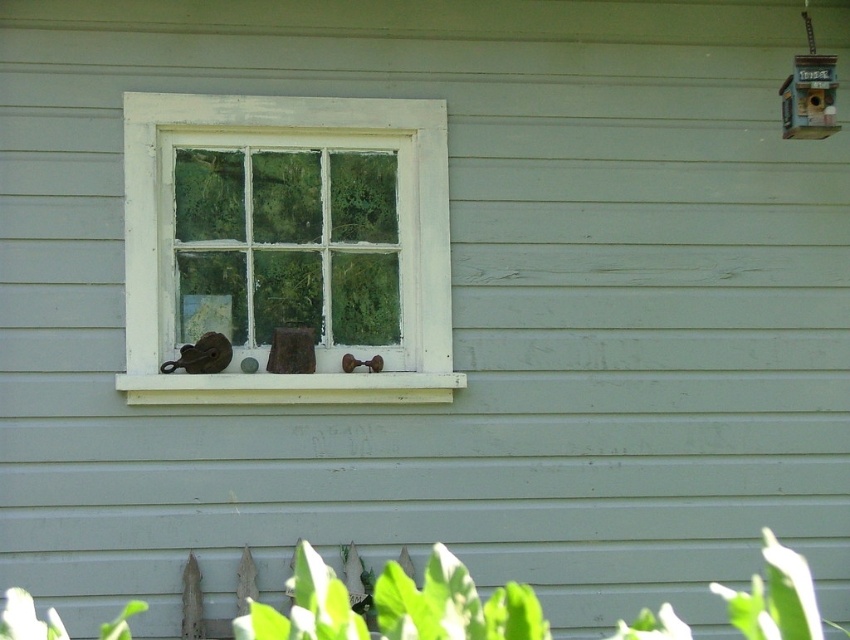
Can you confirm if white painted wood window frame at center is wider than white painted wood at center?

In fact, white painted wood window frame at center might be narrower than white painted wood at center.

Is white painted wood window frame at center shorter than white painted wood at center?

Incorrect, white painted wood window frame at center's height does not fall short of white painted wood at center's.

This screenshot has height=640, width=850. What do you see at coordinates (272, 147) in the screenshot? I see `white painted wood window frame at center` at bounding box center [272, 147].

The height and width of the screenshot is (640, 850). I want to click on white painted wood window frame at center, so click(x=272, y=147).